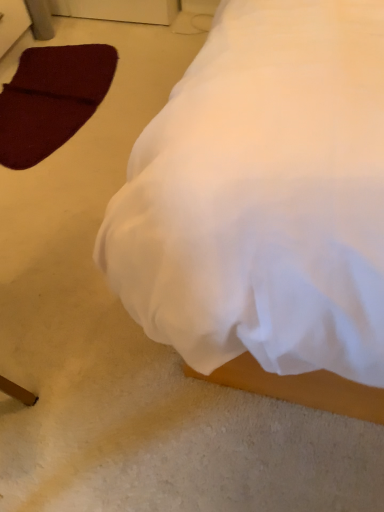
You are a GUI agent. You are given a task and a screenshot of the screen. Output one action in this format:
    pyautogui.click(x=<x>, y=<y>)
    Task: Click on the free point above maroon felt pad at lower left (from a real-world perspective)
    The width and height of the screenshot is (384, 512).
    Given the screenshot: What is the action you would take?
    pyautogui.click(x=57, y=76)